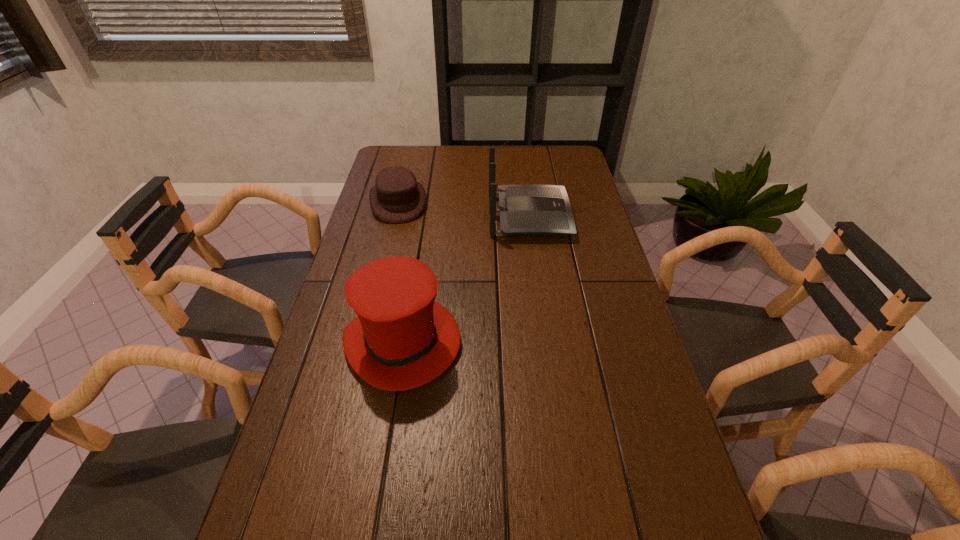
You are a GUI agent. You are given a task and a screenshot of the screen. Output one action in this format:
    pyautogui.click(x=<x>, y=<y>)
    Task: Click on the free space that satisfies the following two spatial constraints: 1. on the front-facing side of the router; 2. on the front side of the shortest object
    This screenshot has width=960, height=540.
    Given the screenshot: What is the action you would take?
    pyautogui.click(x=527, y=202)